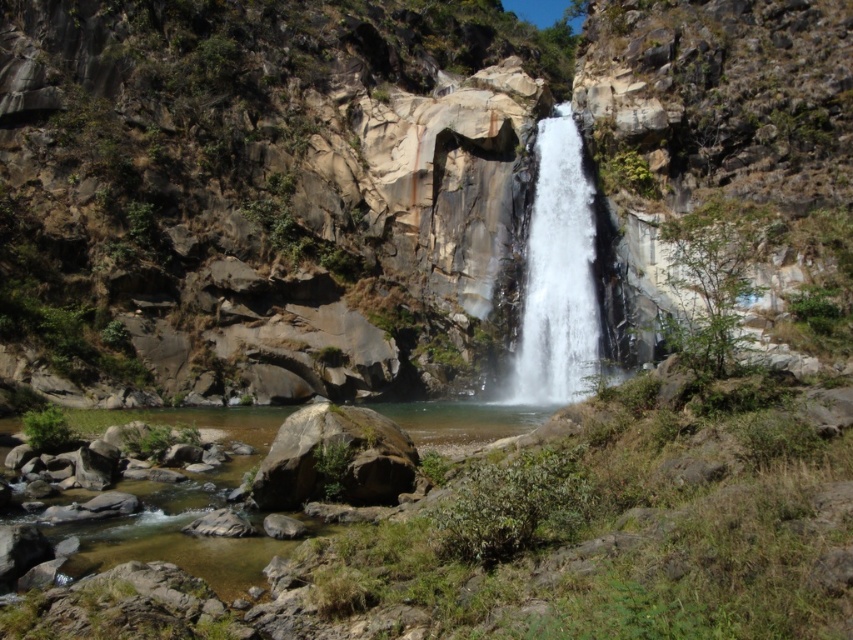
Based on the photo, you are standing at the edge of the pool at the base of the waterfall. If you want to reach the white smooth waterfall at center, in which direction should you walk?

You should walk towards the center of the scene to reach the white smooth waterfall at center, as it is located at point coordinates of [558,275].